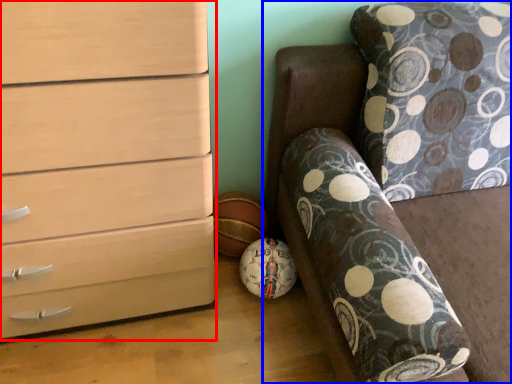
Question: Which object is further to the camera taking this photo, chest of drawers (highlighted by a red box) or furniture (highlighted by a blue box)?

Choices:
 (A) chest of drawers
 (B) furniture

Answer: (A)